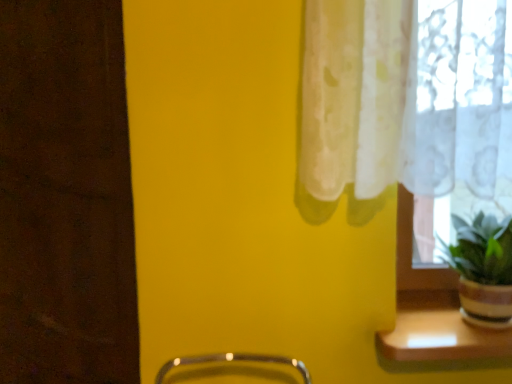
Locate an element on the screen. wooden shelf at lower right is located at coordinates (438, 331).

Measure the distance between point [461,320] and camera.

Point [461,320] is 4.25 feet from camera.

What do you see at coordinates (438, 331) in the screenshot? Image resolution: width=512 pixels, height=384 pixels. I see `wooden shelf at lower right` at bounding box center [438, 331].

Locate an element on the screen. green matte plant at right is located at coordinates (483, 269).

This screenshot has width=512, height=384. What do you see at coordinates (483, 269) in the screenshot?
I see `green matte plant at right` at bounding box center [483, 269].

What is the approximate width of green matte plant at right?

It is 11.72 inches.

You are a GUI agent. You are given a task and a screenshot of the screen. Output one action in this format:
    pyautogui.click(x=<x>, y=<y>)
    Task: Click on the wooden shelf at lower right
    The width and height of the screenshot is (512, 384).
    Given the screenshot: What is the action you would take?
    pyautogui.click(x=438, y=331)

Based on their positions, is wooden shelf at lower right located to the left or right of green matte plant at right?

wooden shelf at lower right is positioned on green matte plant at right's left side.

Is wooden shelf at lower right closer to the viewer compared to green matte plant at right?

No, wooden shelf at lower right is further to the viewer.

Is point (446, 335) positioned after point (463, 223)?

No, it is in front of (463, 223).

Based on the photo, from the image's perspective, which one is positioned lower, wooden shelf at lower right or green matte plant at right?

wooden shelf at lower right.

From a real-world perspective, is wooden shelf at lower right over green matte plant at right?

No.

From the picture: Considering the sizes of objects wooden shelf at lower right and green matte plant at right in the image provided, who is thinner, wooden shelf at lower right or green matte plant at right?

wooden shelf at lower right.

Who is shorter, wooden shelf at lower right or green matte plant at right?

Standing shorter between the two is wooden shelf at lower right.

Can you confirm if wooden shelf at lower right is smaller than green matte plant at right?

Indeed, wooden shelf at lower right has a smaller size compared to green matte plant at right.

Is wooden shelf at lower right inside the boundaries of green matte plant at right, or outside?

wooden shelf at lower right lies outside green matte plant at right.

In the scene shown: Is wooden shelf at lower right next to green matte plant at right?

No, wooden shelf at lower right is not in contact with green matte plant at right.

Is wooden shelf at lower right looking in the opposite direction of green matte plant at right?

No.

Can you tell me how much wooden shelf at lower right and green matte plant at right differ in facing direction?

wooden shelf at lower right and green matte plant at right are facing 0.000796 degrees away from each other.

The image size is (512, 384). I want to click on houseplant above the wooden shelf at lower right (from a real-world perspective), so click(x=483, y=269).

Which object is positioned more to the left, green matte plant at right or wooden shelf at lower right?

wooden shelf at lower right is more to the left.

Which object is further away from the camera, green matte plant at right or wooden shelf at lower right?

wooden shelf at lower right is further from the camera.

Between point (490, 218) and point (457, 346), which one is positioned behind?

The point (490, 218) is farther from the camera.

From the image's perspective, which is above, green matte plant at right or wooden shelf at lower right?

green matte plant at right is shown above in the image.

From a real-world perspective, who is located higher, green matte plant at right or wooden shelf at lower right?

green matte plant at right, from a real-world perspective.

From the picture: Which of these two, green matte plant at right or wooden shelf at lower right, is wider?

green matte plant at right.

Between green matte plant at right and wooden shelf at lower right, which one has more height?

green matte plant at right is taller.

Considering the sizes of objects green matte plant at right and wooden shelf at lower right in the image provided, who is smaller, green matte plant at right or wooden shelf at lower right?

With smaller size is wooden shelf at lower right.

Choose the correct answer: Is green matte plant at right inside wooden shelf at lower right or outside it?

green matte plant at right is outside wooden shelf at lower right.

Does green matte plant at right touch wooden shelf at lower right?

No, green matte plant at right is not in contact with wooden shelf at lower right.

Is green matte plant at right positioned with its back to wooden shelf at lower right?

No, green matte plant at right is not facing away from wooden shelf at lower right.

Consider the image. Can you tell me how much green matte plant at right and wooden shelf at lower right differ in facing direction?

There is a 0.000796-degree angle between the facing directions of green matte plant at right and wooden shelf at lower right.

Locate an element on the screen. The height and width of the screenshot is (384, 512). houseplant above the wooden shelf at lower right (from the image's perspective) is located at coordinates (483, 269).

I want to click on houseplant that is in front of the wooden shelf at lower right, so click(x=483, y=269).

Locate an element on the screen. This screenshot has height=384, width=512. houseplant that is above the wooden shelf at lower right (from the image's perspective) is located at coordinates (483, 269).